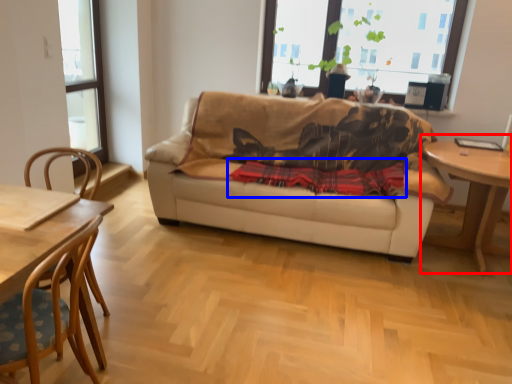
Question: Which of the following is the closest to the observer, table (highlighted by a red box) or plaid (highlighted by a blue box)?

Choices:
 (A) table
 (B) plaid

Answer: (A)